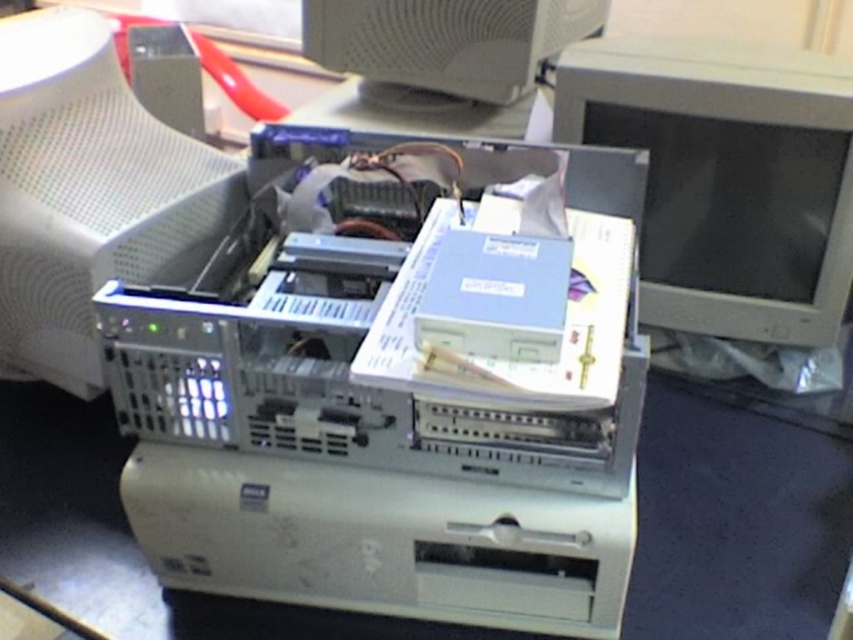
Does matte gray monitor at right appear over white plastic computer monitor at upper left?

Correct, matte gray monitor at right is located above white plastic computer monitor at upper left.

Which is more to the left, matte gray monitor at right or white plastic computer monitor at upper left?

Positioned to the left is white plastic computer monitor at upper left.

Where is `matte gray monitor at right`? This screenshot has width=853, height=640. matte gray monitor at right is located at coordinates (727, 179).

Identify the location of matte gray monitor at right. The image size is (853, 640). (727, 179).

Which is in front, point (54, 141) or point (395, 6)?

Point (54, 141)

Where is `white plastic computer monitor at upper left`? Image resolution: width=853 pixels, height=640 pixels. white plastic computer monitor at upper left is located at coordinates (90, 195).

Is point (782, 321) closer to camera compared to point (587, 13)?

Yes, point (782, 321) is closer to viewer.

Between point (735, 150) and point (303, 0), which one is positioned in front?

Positioned in front is point (735, 150).

Identify the location of matte gray monitor at right. The width and height of the screenshot is (853, 640). (727, 179).